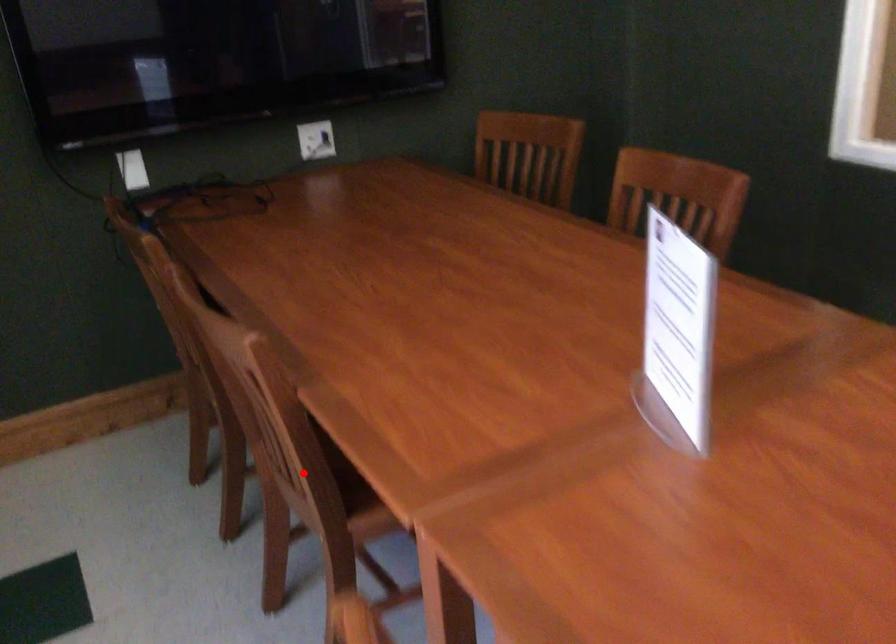
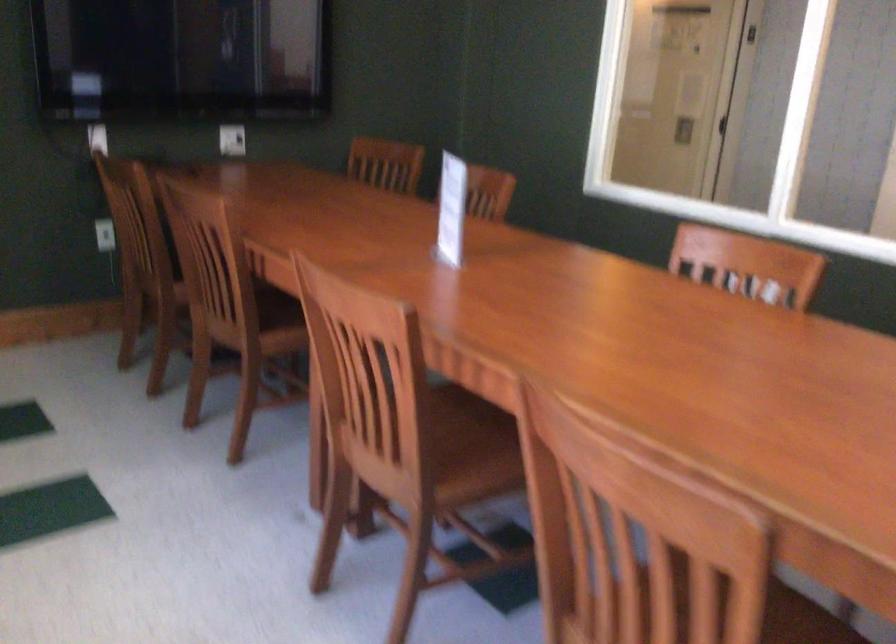
Question: I am providing you with two images of the same scene from different viewpoints. A red point is marked on the first image. Is the red point's position out of view in image 2?

Choices:
 (A) Yes
 (B) No

Answer: (B)